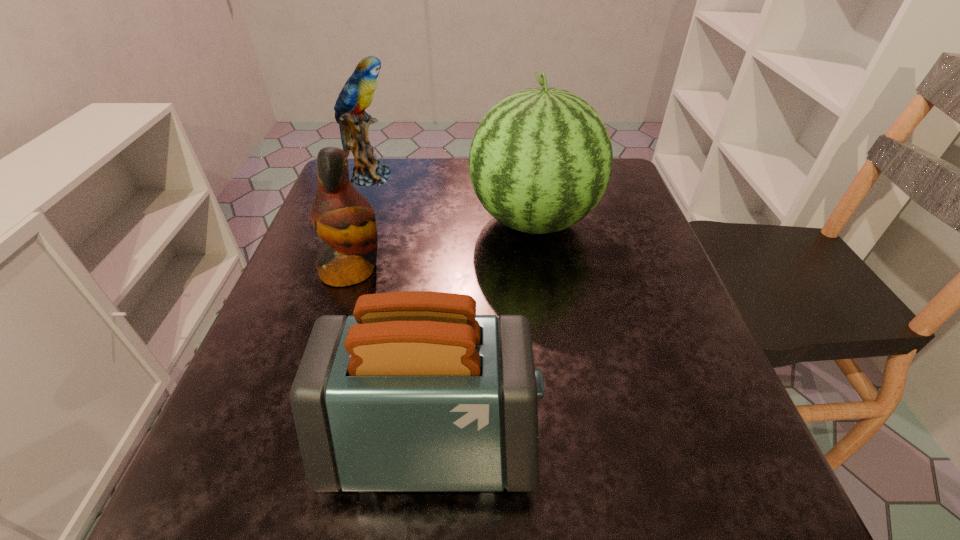
Where is `object situated at the near edge`? The height and width of the screenshot is (540, 960). object situated at the near edge is located at coordinates (414, 392).

I want to click on object situated at the right edge, so click(540, 160).

Identify the location of object situated at the far left corner. The height and width of the screenshot is (540, 960). (357, 94).

I want to click on object at the far right corner, so click(x=540, y=160).

Locate an element on the screen. free space at the near edge of the desktop is located at coordinates (575, 511).

The height and width of the screenshot is (540, 960). I want to click on free space at the left edge of the desktop, so click(276, 354).

Image resolution: width=960 pixels, height=540 pixels. I want to click on vacant space at the right edge, so click(x=605, y=233).

In order to click on vacant area at the far right corner of the desktop in this screenshot , I will do `click(609, 186)`.

The height and width of the screenshot is (540, 960). I want to click on free region at the near right corner of the desktop, so click(x=709, y=474).

Image resolution: width=960 pixels, height=540 pixels. I want to click on vacant space that's between the watermelon and the farther parrot, so click(x=452, y=199).